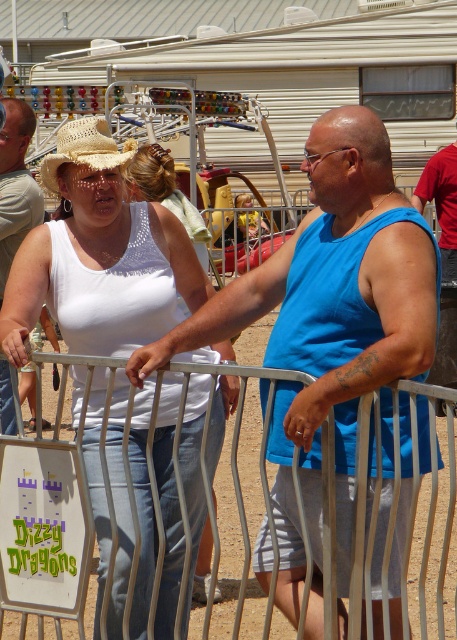
You are standing at the entrance of the fairground and see the blue matte tank top at center and the red cotton shirt at upper right. Which person is positioned closer to the left side of the entrance?

The blue matte tank top at center is positioned to the left of the red cotton shirt at upper right, so the person wearing the blue matte tank top at center is closer to the left side of the entrance.

You are standing in the fairground and see both the white crochet tank top at center and the red cotton shirt at upper right. Which one is nearer to you?

The white crochet tank top at center is closer to the viewer than the red cotton shirt at upper right.

Consider the image. You are standing at the fairground and see the blue matte tank top at center and the red cotton shirt at upper right. Which one is nearer to you?

The blue matte tank top at center is closer to the viewer than the red cotton shirt at upper right.